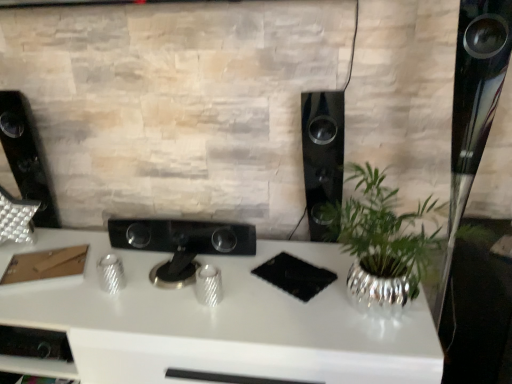
Where is `white glossy desk at center`? The width and height of the screenshot is (512, 384). white glossy desk at center is located at coordinates (219, 321).

This screenshot has width=512, height=384. What do you see at coordinates (219, 321) in the screenshot? I see `white glossy desk at center` at bounding box center [219, 321].

Describe the element at coordinates (322, 153) in the screenshot. I see `black glossy speaker at center-right, the second speaker positioned from the left` at that location.

Identify the location of white glossy desk at center. The image size is (512, 384). (219, 321).

What's the angular difference between black glossy controller at center and black glossy speaker at center-right, the second speaker positioned from the left,'s facing directions?

They differ by 0.000565 degrees in their facing directions.

Is black glossy controller at center inside or outside of black glossy speaker at center-right, placed as the first speaker when sorted from right to left?

black glossy controller at center is not enclosed by black glossy speaker at center-right, placed as the first speaker when sorted from right to left.

Where is `appliance lying behind the black glossy speaker at center-right, the second speaker positioned from the left`? This screenshot has width=512, height=384. appliance lying behind the black glossy speaker at center-right, the second speaker positioned from the left is located at coordinates (181, 243).

Considering the sizes of objects black glossy controller at center and black glossy speaker at center-right, placed as the first speaker when sorted from right to left, in the image provided, who is shorter, black glossy controller at center or black glossy speaker at center-right, placed as the first speaker when sorted from right to left,?

Standing shorter between the two is black glossy controller at center.

Is white glossy desk at center facing away from black glossy speaker at center-right, placed as the first speaker when sorted from right to left?

No, white glossy desk at center is not facing the opposite direction of black glossy speaker at center-right, placed as the first speaker when sorted from right to left.

Does point (139, 281) come in front of point (322, 168)?

Yes.

Between white glossy desk at center and black glossy speaker at center-right, the second speaker positioned from the left, which one appears on the left side from the viewer's perspective?

Positioned to the left is white glossy desk at center.

Based on the photo, considering the sizes of black glossy speaker at left, which ranks as the 2th speaker in right-to-left order, and black glossy speaker at center-right, placed as the first speaker when sorted from right to left, in the image, is black glossy speaker at left, which ranks as the 2th speaker in right-to-left order, taller or shorter than black glossy speaker at center-right, placed as the first speaker when sorted from right to left,?

Clearly, black glossy speaker at left, which ranks as the 2th speaker in right-to-left order, is shorter compared to black glossy speaker at center-right, placed as the first speaker when sorted from right to left.

Which point is more distant from viewer, (x=55, y=209) or (x=327, y=191)?

Positioned behind is point (x=55, y=209).

Between black glossy speaker at left, which ranks as the 2th speaker in right-to-left order, and black glossy speaker at center-right, the second speaker positioned from the left, which one appears on the right side from the viewer's perspective?

black glossy speaker at center-right, the second speaker positioned from the left.

From the image's perspective, which is below, black glossy speaker at left, which is the 1th speaker in left-to-right order, or black glossy speaker at center-right, the second speaker positioned from the left?

black glossy speaker at center-right, the second speaker positioned from the left, appears lower in the image.

Consider the image. Considering the relative positions of black glossy controller at center and white glossy desk at center in the image provided, is black glossy controller at center to the left or to the right of white glossy desk at center?

In the image, black glossy controller at center appears on the right side of white glossy desk at center.

The image size is (512, 384). Find the location of `appliance behind the white glossy desk at center`. appliance behind the white glossy desk at center is located at coordinates (181, 243).

Is there a large distance between black glossy controller at center and white glossy desk at center?

Actually, black glossy controller at center and white glossy desk at center are a little close together.

Would you say black glossy controller at center contains white glossy desk at center?

No.

From a real-world perspective, is white glossy desk at center above or below black glossy controller at center?

white glossy desk at center is situated lower than black glossy controller at center in the real world.

I want to click on appliance that is on the right side of white glossy desk at center, so click(x=181, y=243).

Which of these two, white glossy desk at center or black glossy controller at center, is wider?

Wider between the two is white glossy desk at center.

In the scene shown: Would you consider white glossy desk at center to be distant from black glossy controller at center?

white glossy desk at center is actually quite close to black glossy controller at center.

From a real-world perspective, which is physically below, black glossy speaker at left, which is the 1th speaker in left-to-right order, or black glossy controller at center?

black glossy controller at center.

Between black glossy speaker at left, which ranks as the 2th speaker in right-to-left order, and black glossy controller at center, which one has less height?

black glossy controller at center is shorter.

Locate an element on the screen. The image size is (512, 384). speaker on the left side of black glossy controller at center is located at coordinates (25, 158).

Which object is wider, black glossy speaker at left, which is the 1th speaker in left-to-right order, or white glossy desk at center?

white glossy desk at center.

From the picture: What's the angular difference between black glossy speaker at left, which ranks as the 2th speaker in right-to-left order, and white glossy desk at center's facing directions?

The angular difference between black glossy speaker at left, which ranks as the 2th speaker in right-to-left order, and white glossy desk at center is 0.346 degrees.

Who is more distant, black glossy speaker at left, which ranks as the 2th speaker in right-to-left order, or white glossy desk at center?

black glossy speaker at left, which ranks as the 2th speaker in right-to-left order, is behind.

Does black glossy speaker at left, which ranks as the 2th speaker in right-to-left order, have a larger size compared to white glossy desk at center?

No, black glossy speaker at left, which ranks as the 2th speaker in right-to-left order, is not bigger than white glossy desk at center.

Where is `appliance that is behind the black glossy speaker at center-right, the second speaker positioned from the left`? The width and height of the screenshot is (512, 384). appliance that is behind the black glossy speaker at center-right, the second speaker positioned from the left is located at coordinates (181, 243).

Locate an element on the screen. The width and height of the screenshot is (512, 384). the 1st speaker above the white glossy desk at center (from the image's perspective) is located at coordinates (322, 153).

Considering their positions, is black glossy speaker at center-right, the second speaker positioned from the left, positioned closer to black glossy speaker at left, which is the 1th speaker in left-to-right order, than black glossy controller at center?

black glossy controller at center is positioned closer to the anchor black glossy speaker at left, which is the 1th speaker in left-to-right order.

Based on their spatial positions, is white glossy desk at center or black glossy speaker at center-right, placed as the first speaker when sorted from right to left, closer to black glossy speaker at left, which ranks as the 2th speaker in right-to-left order?

Among the two, white glossy desk at center is located nearer to black glossy speaker at left, which ranks as the 2th speaker in right-to-left order.

Based on their spatial positions, is black glossy controller at center or black glossy speaker at left, which ranks as the 2th speaker in right-to-left order, further from black glossy speaker at center-right, the second speaker positioned from the left?

Among the two, black glossy speaker at left, which ranks as the 2th speaker in right-to-left order, is located further to black glossy speaker at center-right, the second speaker positioned from the left.

Which object lies nearer to the anchor point white glossy desk at center, black glossy controller at center or black glossy speaker at left, which is the 1th speaker in left-to-right order?

Among the two, black glossy controller at center is located nearer to white glossy desk at center.

From the image, which object appears to be nearer to black glossy controller at center, black glossy speaker at left, which is the 1th speaker in left-to-right order, or white glossy desk at center?

white glossy desk at center lies closer to black glossy controller at center than the other object.

Looking at the image, which one is located closer to white glossy desk at center, black glossy controller at center or black glossy speaker at center-right, placed as the first speaker when sorted from right to left?

Among the two, black glossy controller at center is located nearer to white glossy desk at center.

Looking at the image, which one is located further to black glossy speaker at center-right, the second speaker positioned from the left, black glossy speaker at left, which ranks as the 2th speaker in right-to-left order, or white glossy desk at center?

black glossy speaker at left, which ranks as the 2th speaker in right-to-left order, lies further to black glossy speaker at center-right, the second speaker positioned from the left, than the other object.

Consider the image. From the image, which object appears to be nearer to black glossy speaker at left, which ranks as the 2th speaker in right-to-left order, black glossy speaker at center-right, placed as the first speaker when sorted from right to left, or white glossy desk at center?

Among the two, white glossy desk at center is located nearer to black glossy speaker at left, which ranks as the 2th speaker in right-to-left order.

This screenshot has width=512, height=384. I want to click on desk situated between black glossy speaker at left, which ranks as the 2th speaker in right-to-left order, and black glossy speaker at center-right, placed as the first speaker when sorted from right to left, from left to right, so click(x=219, y=321).

At what (x,y) coordinates should I click in order to perform the action: click on appliance situated between black glossy speaker at left, which ranks as the 2th speaker in right-to-left order, and black glossy speaker at center-right, placed as the first speaker when sorted from right to left, from left to right. Please return your answer as a coordinate pair (x, y). Looking at the image, I should click on (181, 243).

Image resolution: width=512 pixels, height=384 pixels. What are the coordinates of `appliance situated between white glossy desk at center and black glossy speaker at center-right, the second speaker positioned from the left, from left to right` in the screenshot? It's located at (181, 243).

Where is `desk between black glossy speaker at left, which is the 1th speaker in left-to-right order, and black glossy controller at center from left to right`? This screenshot has width=512, height=384. desk between black glossy speaker at left, which is the 1th speaker in left-to-right order, and black glossy controller at center from left to right is located at coordinates (219, 321).